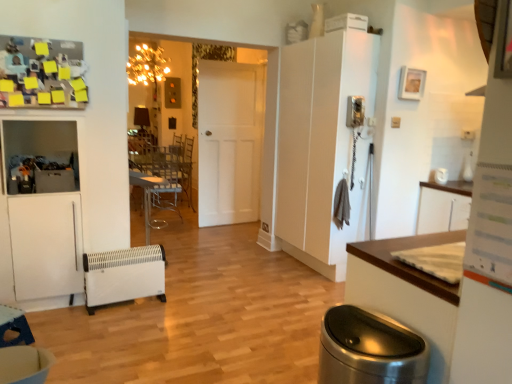
Image resolution: width=512 pixels, height=384 pixels. In order to click on wooden table at lower left, which appears as the 1th table when viewed from the front in this screenshot , I will do `click(14, 326)`.

Measure the distance between point (3, 313) and camera.

Point (3, 313) is 3.00 meters away from camera.

This screenshot has width=512, height=384. What do you see at coordinates (124, 275) in the screenshot?
I see `white matte heater at lower left` at bounding box center [124, 275].

Image resolution: width=512 pixels, height=384 pixels. What do you see at coordinates (322, 144) in the screenshot? I see `white matte cabinet at right` at bounding box center [322, 144].

I want to click on metallic silver table at center, arranged as the 2th table when ordered from the bottom, so click(147, 198).

Where is `polished stainless steel trash can at lower right`? The height and width of the screenshot is (384, 512). polished stainless steel trash can at lower right is located at coordinates (369, 349).

Considering the sizes of objects metallic silver table at center, which is the first table in top-to-bottom order, and polished stainless steel trash can at lower right in the image provided, who is bigger, metallic silver table at center, which is the first table in top-to-bottom order, or polished stainless steel trash can at lower right?

With larger size is metallic silver table at center, which is the first table in top-to-bottom order.

In terms of width, does metallic silver table at center, the 2th table in the left-to-right sequence, look wider or thinner when compared to polished stainless steel trash can at lower right?

In the image, metallic silver table at center, the 2th table in the left-to-right sequence, appears to be wider than polished stainless steel trash can at lower right.

Is metallic silver table at center, arranged as the first table when viewed from the right, positioned with its back to polished stainless steel trash can at lower right?

No, metallic silver table at center, arranged as the first table when viewed from the right,'s orientation is not away from polished stainless steel trash can at lower right.

Which of these two, polished stainless steel trash can at lower right or white matte heater at lower left, stands shorter?

white matte heater at lower left.

Is polished stainless steel trash can at lower right facing away from white matte heater at lower left?

No, polished stainless steel trash can at lower right is not facing the opposite direction of white matte heater at lower left.

Is polished stainless steel trash can at lower right situated inside white matte heater at lower left or outside?

polished stainless steel trash can at lower right cannot be found inside white matte heater at lower left.

From the image's perspective, which one is positioned lower, polished stainless steel trash can at lower right or wooden table at lower left, the 2th table positioned from the back?

wooden table at lower left, the 2th table positioned from the back.

This screenshot has height=384, width=512. There is a polished stainless steel trash can at lower right. Find the location of `the 2nd table below it (from a real-world perspective)`. the 2nd table below it (from a real-world perspective) is located at coordinates (14, 326).

Is polished stainless steel trash can at lower right to the left of wooden table at lower left, placed as the 1th table when sorted from bottom to top, from the viewer's perspective?

Incorrect, polished stainless steel trash can at lower right is not on the left side of wooden table at lower left, placed as the 1th table when sorted from bottom to top.

Between polished stainless steel trash can at lower right and wooden table at lower left, which appears as the 1th table when viewed from the front, which one is positioned in front?

polished stainless steel trash can at lower right is in front.

Considering the sizes of objects polished stainless steel trash can at lower right and metallic silver table at center, which is the first table in top-to-bottom order, in the image provided, who is taller, polished stainless steel trash can at lower right or metallic silver table at center, which is the first table in top-to-bottom order,?

metallic silver table at center, which is the first table in top-to-bottom order, is taller.

Is polished stainless steel trash can at lower right positioned in front of metallic silver table at center, placed as the 2th table when sorted from front to back?

Yes, the depth of polished stainless steel trash can at lower right is less than that of metallic silver table at center, placed as the 2th table when sorted from front to back.

From the image's perspective, which one is positioned lower, polished stainless steel trash can at lower right or metallic silver table at center, the 1th table when ordered from back to front?

polished stainless steel trash can at lower right is shown below in the image.

Considering the sizes of polished stainless steel trash can at lower right and metallic silver table at center, arranged as the first table when viewed from the right, in the image, is polished stainless steel trash can at lower right wider or thinner than metallic silver table at center, arranged as the first table when viewed from the right,?

Clearly, polished stainless steel trash can at lower right has less width compared to metallic silver table at center, arranged as the first table when viewed from the right.

Is metallic silver table at center, which is the first table in top-to-bottom order, not inside white matte door at center?

metallic silver table at center, which is the first table in top-to-bottom order, is positioned outside white matte door at center.

Would you say metallic silver table at center, which is the first table in top-to-bottom order, is to the left or to the right of white matte door at center in the picture?

Based on their positions, metallic silver table at center, which is the first table in top-to-bottom order, is located to the left of white matte door at center.

From a real-world perspective, is metallic silver table at center, which is the first table in top-to-bottom order, above or below white matte door at center?

metallic silver table at center, which is the first table in top-to-bottom order, is below white matte door at center.

From the image's perspective, is metallic silver table at center, the 2th table in the left-to-right sequence, above white matte door at center?

No.

Which of these two, white matte cabinet at right or clear plastic chair at center, is bigger?

white matte cabinet at right is bigger.

Can you confirm if white matte cabinet at right is thinner than clear plastic chair at center?

Correct, the width of white matte cabinet at right is less than that of clear plastic chair at center.

Are white matte cabinet at right and clear plastic chair at center located far from each other?

Yes, white matte cabinet at right and clear plastic chair at center are located far from each other.

Is wooden table at lower left, placed as the 1th table when sorted from bottom to top, facing away from clear plastic chair at center?

No, wooden table at lower left, placed as the 1th table when sorted from bottom to top, is not facing the opposite direction of clear plastic chair at center.

From the image's perspective, which table is the 2nd one below the clear plastic chair at center? Please provide its 2D coordinates.

[(14, 326)]

In terms of width, does wooden table at lower left, placed as the 1th table when sorted from bottom to top, look wider or thinner when compared to clear plastic chair at center?

In the image, wooden table at lower left, placed as the 1th table when sorted from bottom to top, appears to be more narrow than clear plastic chair at center.

Which is correct: wooden table at lower left, which is counted as the 2th table, starting from the right, is inside clear plastic chair at center, or outside of it?

wooden table at lower left, which is counted as the 2th table, starting from the right, cannot be found inside clear plastic chair at center.

Identify the location of table that is the 1st one below the polished stainless steel trash can at lower right (from a real-world perspective). (147, 198).

Where is `waste container below the white matte heater at lower left (from the image's perspective)`? This screenshot has width=512, height=384. waste container below the white matte heater at lower left (from the image's perspective) is located at coordinates (369, 349).

Looking at the image, which one is located further to polished stainless steel trash can at lower right, metallic silver table at center, placed as the 2th table when sorted from front to back, or clear plastic chair at center?

metallic silver table at center, placed as the 2th table when sorted from front to back, lies further to polished stainless steel trash can at lower right than the other object.

From the image, which object appears to be nearer to metallic silver table at center, arranged as the 2th table when ordered from the bottom, clear plastic chair at center or white matte heater at lower left?

Based on the image, clear plastic chair at center appears to be nearer to metallic silver table at center, arranged as the 2th table when ordered from the bottom.

When comparing their distances from clear plastic chair at center, does white matte door at center or metallic silver table at center, the 2th table in the left-to-right sequence, seem further?

white matte door at center is further to clear plastic chair at center.

Based on their spatial positions, is clear plastic chair at center or polished stainless steel trash can at lower right further from white matte heater at lower left?

clear plastic chair at center.

Looking at the image, which one is located closer to polished stainless steel trash can at lower right, clear plastic chair at center or wooden table at lower left, marked as the first table in a left-to-right arrangement?

wooden table at lower left, marked as the first table in a left-to-right arrangement, is closer to polished stainless steel trash can at lower right.

Estimate the real-world distances between objects in this image. Which object is closer to polished stainless steel trash can at lower right, metallic silver table at center, the 1th table when ordered from back to front, or white matte heater at lower left?

white matte heater at lower left is closer to polished stainless steel trash can at lower right.

From the image, which object appears to be farther from polished stainless steel trash can at lower right, wooden table at lower left, which appears as the 1th table when viewed from the front, or white matte cabinet at right?

white matte cabinet at right.

From the image, which object appears to be farther from metallic silver table at center, the 2th table in the left-to-right sequence, white matte cabinet at right or white matte heater at lower left?

white matte cabinet at right is further to metallic silver table at center, the 2th table in the left-to-right sequence.

At what (x,y) coordinates should I click in order to perform the action: click on appliance between wooden table at lower left, which appears as the 1th table when viewed from the front, and white matte door at center, along the z-axis. Please return your answer as a coordinate pair (x, y). Looking at the image, I should click on (124, 275).

Where is `appliance between metallic silver table at center, the 1th table when ordered from back to front, and white matte cabinet at right`? appliance between metallic silver table at center, the 1th table when ordered from back to front, and white matte cabinet at right is located at coordinates (124, 275).

At what (x,y) coordinates should I click in order to perform the action: click on table between white matte heater at lower left and clear plastic chair at center from front to back. Please return your answer as a coordinate pair (x, y). Looking at the image, I should click on (147, 198).

Find the location of a particular element. This screenshot has height=384, width=512. appliance between wooden table at lower left, marked as the second table in a top-to-bottom arrangement, and clear plastic chair at center in the front-back direction is located at coordinates point(124,275).